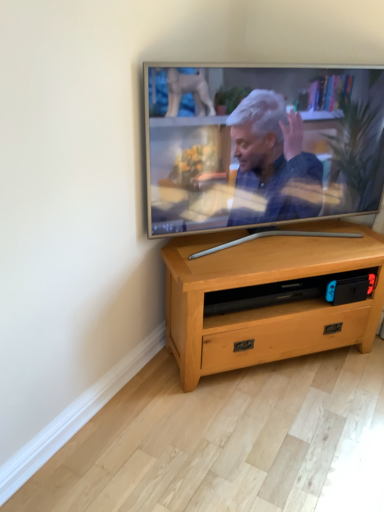
Identify the location of silver metallic television at upper center. (261, 145).

Measure the distance between silver metallic television at upper center and camera.

1.48 meters.

What do you see at coordinates (261, 145) in the screenshot? The width and height of the screenshot is (384, 512). I see `silver metallic television at upper center` at bounding box center [261, 145].

What is the approximate width of silver metallic television at upper center?

silver metallic television at upper center is 19.15 centimeters wide.

Locate an element on the screen. The image size is (384, 512). light wood/texture tv stand at center is located at coordinates (265, 307).

What is the approximate width of light wood/texture tv stand at center?

light wood/texture tv stand at center is 14.07 inches in width.

Describe the element at coordinates (265, 307) in the screenshot. I see `light wood/texture tv stand at center` at that location.

Find the location of `silver metallic television at upper center`. silver metallic television at upper center is located at coordinates (261, 145).

Looking at this image, considering the positions of objects silver metallic television at upper center and light wood/texture tv stand at center in the image provided, who is more to the left, silver metallic television at upper center or light wood/texture tv stand at center?

From the viewer's perspective, silver metallic television at upper center appears more on the left side.

Which is behind, silver metallic television at upper center or light wood/texture tv stand at center?

light wood/texture tv stand at center is behind.

Does point (149, 230) come behind point (342, 257)?

No, (149, 230) is closer to viewer.

From the image's perspective, which one is positioned lower, silver metallic television at upper center or light wood/texture tv stand at center?

light wood/texture tv stand at center, from the image's perspective.

From a real-world perspective, does silver metallic television at upper center stand above light wood/texture tv stand at center?

Correct, in the physical world, silver metallic television at upper center is higher than light wood/texture tv stand at center.

Does silver metallic television at upper center have a greater width compared to light wood/texture tv stand at center?

No.

Is silver metallic television at upper center taller than light wood/texture tv stand at center?

Correct, silver metallic television at upper center is much taller as light wood/texture tv stand at center.

Based on their sizes in the image, would you say silver metallic television at upper center is bigger or smaller than light wood/texture tv stand at center?

In the image, silver metallic television at upper center appears to be smaller than light wood/texture tv stand at center.

Can we say silver metallic television at upper center lies outside light wood/texture tv stand at center?

silver metallic television at upper center lies outside light wood/texture tv stand at center's area.

Are silver metallic television at upper center and light wood/texture tv stand at center located far from each other?

No, silver metallic television at upper center is not far away from light wood/texture tv stand at center.

Is light wood/texture tv stand at center at the back of silver metallic television at upper center?

No, light wood/texture tv stand at center is not at the back of silver metallic television at upper center.

How many degrees apart are the facing directions of silver metallic television at upper center and light wood/texture tv stand at center?

The angle between the facing direction of silver metallic television at upper center and the facing direction of light wood/texture tv stand at center is 0.357 degrees.

Find the location of a particular element. The image size is (384, 512). television above the light wood/texture tv stand at center (from a real-world perspective) is located at coordinates (261, 145).

Would you say light wood/texture tv stand at center is to the left or to the right of silver metallic television at upper center in the picture?

From the image, it's evident that light wood/texture tv stand at center is to the right of silver metallic television at upper center.

Between light wood/texture tv stand at center and silver metallic television at upper center, which one is positioned in front?

Positioned in front is silver metallic television at upper center.

Does point (227, 280) appear closer or farther from the camera than point (331, 113)?

Point (227, 280) appears to be closer to the viewer than point (331, 113).

From the image's perspective, which object appears higher, light wood/texture tv stand at center or silver metallic television at upper center?

silver metallic television at upper center appears higher in the image.

From a real-world perspective, who is located lower, light wood/texture tv stand at center or silver metallic television at upper center?

light wood/texture tv stand at center is physically lower.

Considering the sizes of objects light wood/texture tv stand at center and silver metallic television at upper center in the image provided, who is thinner, light wood/texture tv stand at center or silver metallic television at upper center?

With smaller width is silver metallic television at upper center.

Is light wood/texture tv stand at center taller or shorter than silver metallic television at upper center?

In the image, light wood/texture tv stand at center appears to be shorter than silver metallic television at upper center.

Considering the relative sizes of light wood/texture tv stand at center and silver metallic television at upper center in the image provided, is light wood/texture tv stand at center smaller than silver metallic television at upper center?

Actually, light wood/texture tv stand at center might be larger than silver metallic television at upper center.

Looking at this image, is light wood/texture tv stand at center not within silver metallic television at upper center?

light wood/texture tv stand at center is positioned outside silver metallic television at upper center.

Is light wood/texture tv stand at center next to silver metallic television at upper center and touching it?

light wood/texture tv stand at center and silver metallic television at upper center are clearly separated.

Is light wood/texture tv stand at center facing towards silver metallic television at upper center?

No, light wood/texture tv stand at center is not oriented towards silver metallic television at upper center.

What's the angular difference between light wood/texture tv stand at center and silver metallic television at upper center's facing directions?

0.357 degrees.

I want to click on desk on the right of the silver metallic television at upper center, so click(265, 307).

Locate an element on the screen. Image resolution: width=384 pixels, height=512 pixels. desk located below the silver metallic television at upper center (from the image's perspective) is located at coordinates (265, 307).

The image size is (384, 512). I want to click on television positioned vertically above the light wood/texture tv stand at center (from a real-world perspective), so click(261, 145).